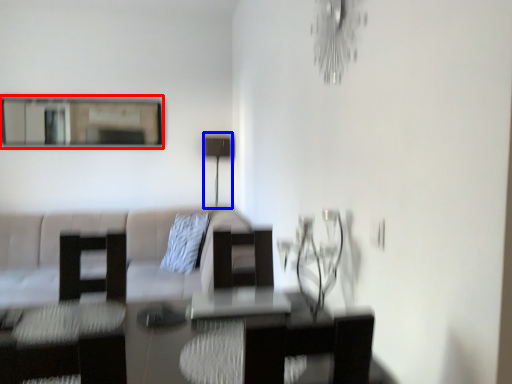
Question: Which of the following is the farthest to the observer, mirror (highlighted by a red box) or lamp (highlighted by a blue box)?

Choices:
 (A) mirror
 (B) lamp

Answer: (B)